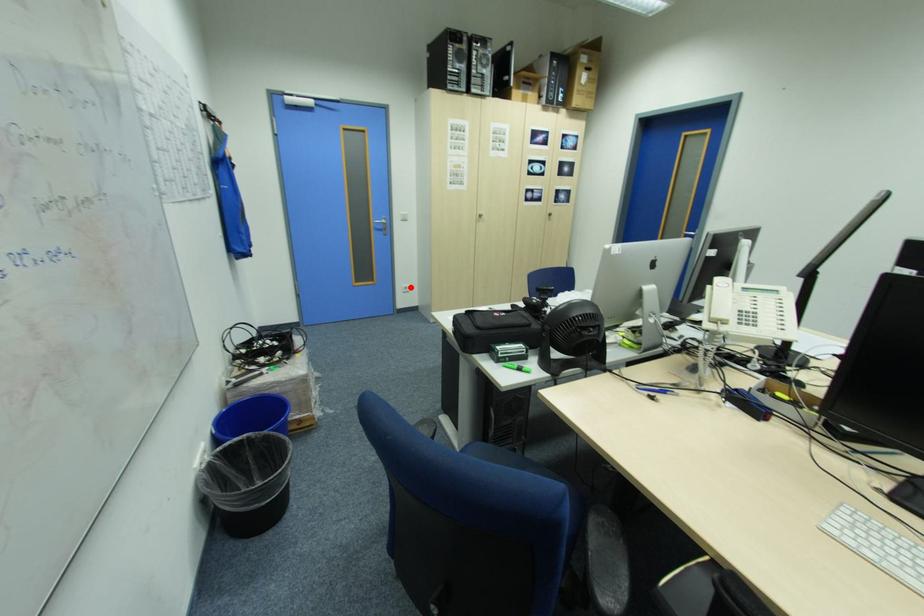
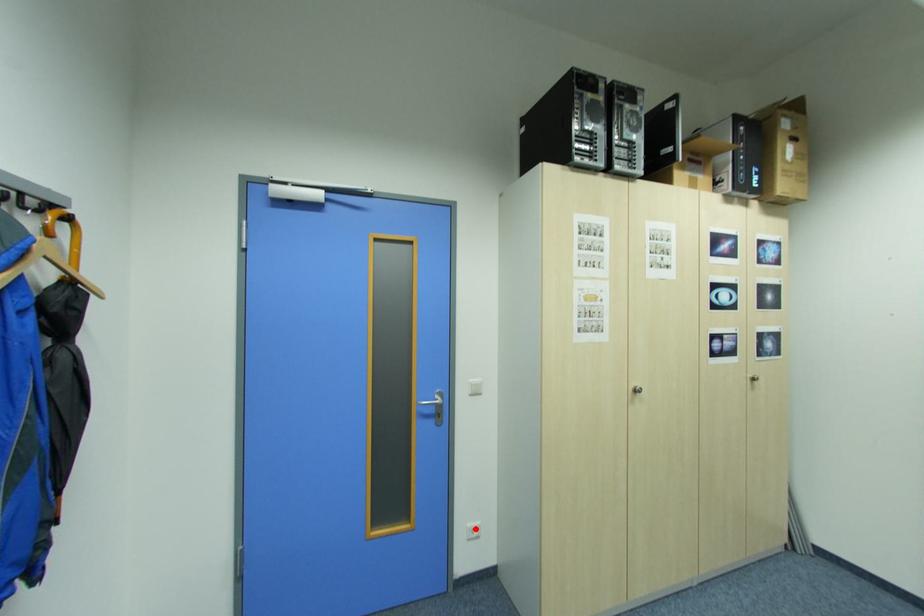
From the picture: I am providing you with two images of the same scene from different viewpoints. A red point is marked on the first image and another point is marked on the second image. Is the red point in image1 aligned with the point shown in image2?

Yes